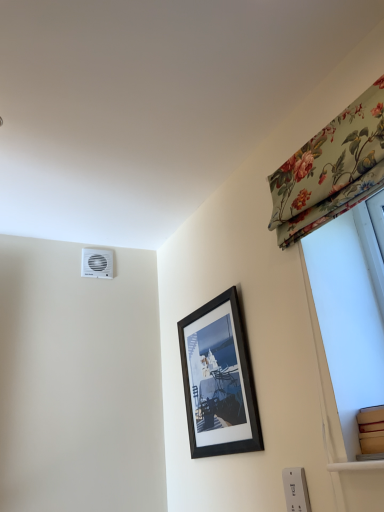
Question: From a real-world perspective, is white plastic electric outlet at lower right positioned above or below floral fabric curtain at upper right?

Choices:
 (A) below
 (B) above

Answer: (A)

Question: Is white plastic electric outlet at lower right to the left or to the right of floral fabric curtain at upper right in the image?

Choices:
 (A) right
 (B) left

Answer: (B)

Question: Estimate the real-world distances between objects in this image. Which object is farther from the white plastic electric outlet at lower right?

Choices:
 (A) white plastic air conditioning unit at upper left
 (B) black matte picture frame at center
 (C) floral fabric curtain at upper right

Answer: (A)

Question: Considering the real-world distances, which object is farthest from the white plastic electric outlet at lower right?

Choices:
 (A) black matte picture frame at center
 (B) white plastic air conditioning unit at upper left
 (C) floral fabric curtain at upper right

Answer: (B)